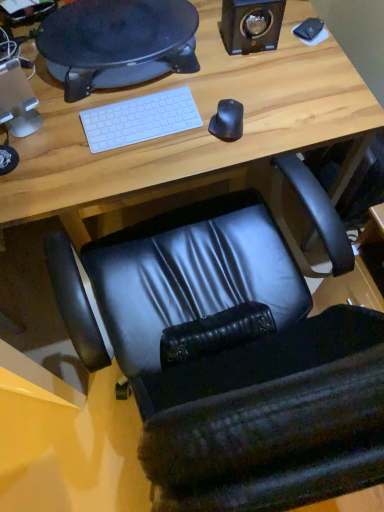
Locate an element on the screen. free location to the right of black rubber mouse at center is located at coordinates (278, 125).